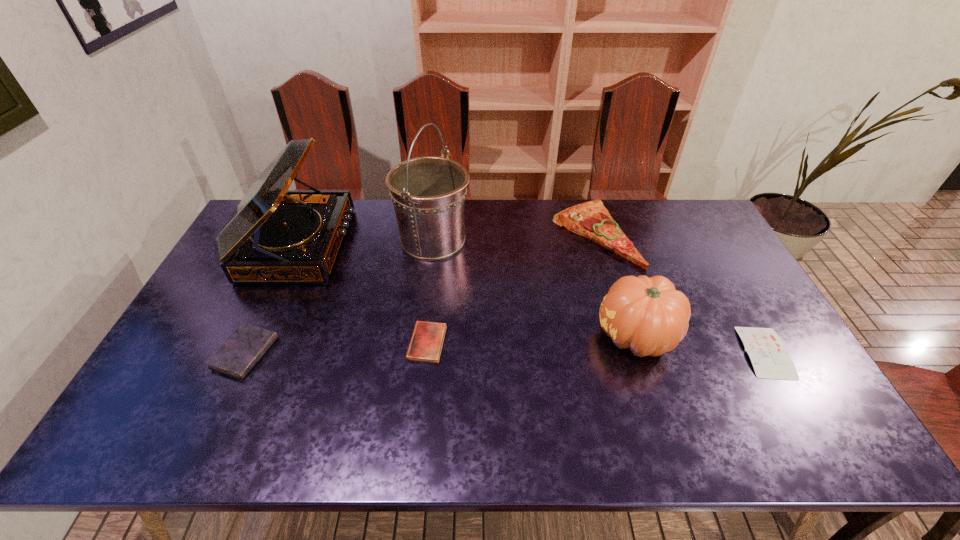
Where is `bucket`? Image resolution: width=960 pixels, height=540 pixels. bucket is located at coordinates (428, 193).

The width and height of the screenshot is (960, 540). What are the coordinates of `the sixth shortest object` in the screenshot? It's located at (274, 236).

What are the coordinates of `pumpkin` in the screenshot? It's located at (648, 315).

Identify the location of pizza. (591, 219).

Find the location of a particular element. the fifth tallest object is located at coordinates (241, 351).

You are a GUI agent. You are given a task and a screenshot of the screen. Output one action in this format:
    pyautogui.click(x=<x>, y=<y>)
    Task: Click on the leftmost diary
    This screenshot has height=540, width=960.
    Given the screenshot: What is the action you would take?
    pyautogui.click(x=241, y=351)

Find the location of a particular element. The width and height of the screenshot is (960, 540). the second tallest diary is located at coordinates (427, 339).

Identify the location of the second shortest object. This screenshot has width=960, height=540. (427, 339).

Where is `the shortest object`? This screenshot has height=540, width=960. the shortest object is located at coordinates (768, 355).

Locate an element on the screen. The height and width of the screenshot is (540, 960). the rightmost object is located at coordinates (768, 355).